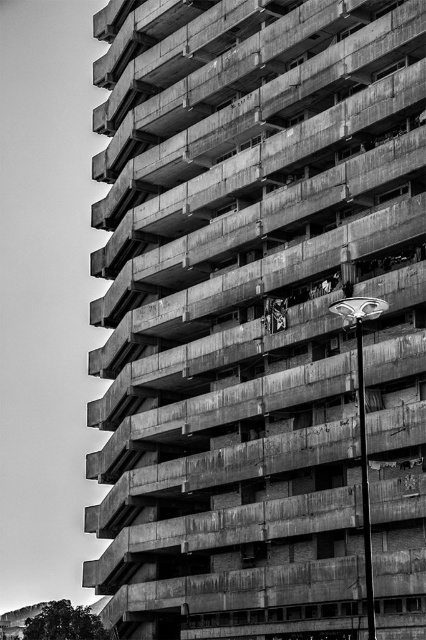
Is metallic street sign at center-right taller than metallic silver skateboard at center?

Yes, metallic street sign at center-right is taller than metallic silver skateboard at center.

Identify the location of metallic street sign at center-right. Image resolution: width=426 pixels, height=640 pixels. (362, 424).

What are the coordinates of `metallic street sign at center-right` in the screenshot? It's located at (362, 424).